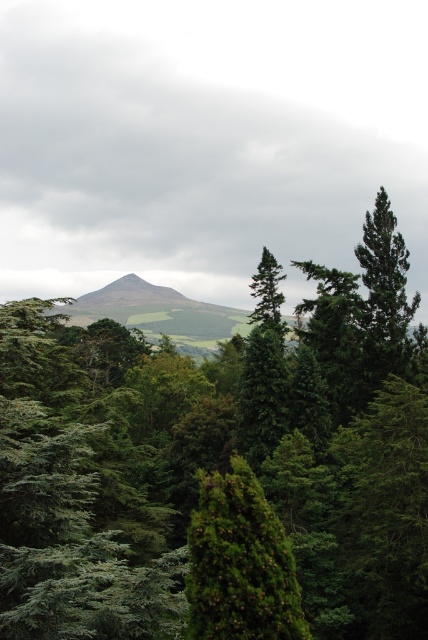
You are an environmental scientist assessing the forest structure. You observe the green matte tree at upper right and the green matte tree at center. Which tree is shorter?

The green matte tree at upper right is shorter than the green matte tree at center.